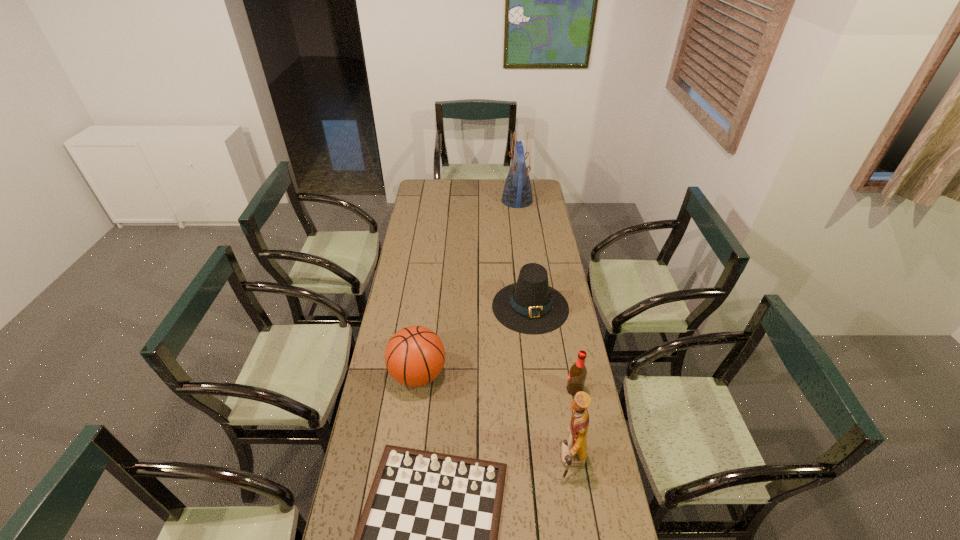
Image resolution: width=960 pixels, height=540 pixels. Find the location of `free spot located 0.150m on the front of the basketball`. free spot located 0.150m on the front of the basketball is located at coordinates (410, 439).

Find the location of a particular element. This screenshot has height=540, width=960. vacant space located 0.180m on the back of the beer bottle is located at coordinates (566, 345).

This screenshot has width=960, height=540. Identify the location of free space located 0.120m on the front-facing side of the fifth nearest object. (537, 358).

Locate an element on the screen. This screenshot has height=540, width=960. object present at the far edge is located at coordinates (517, 193).

This screenshot has width=960, height=540. Identify the location of object that is at the left edge. (414, 356).

I want to click on shopping bag that is at the right edge, so click(517, 193).

Identify the location of nutcracker positioned at the right edge. (573, 450).

At what (x,y) coordinates should I click in order to perform the action: click on beer bottle that is at the right edge. Please return your answer as a coordinate pair (x, y). The image size is (960, 540). Looking at the image, I should click on (577, 375).

Find the location of a particular element. The width and height of the screenshot is (960, 540). hat present at the right edge is located at coordinates (530, 306).

Where is `object that is at the far right corner`? This screenshot has height=540, width=960. object that is at the far right corner is located at coordinates (517, 193).